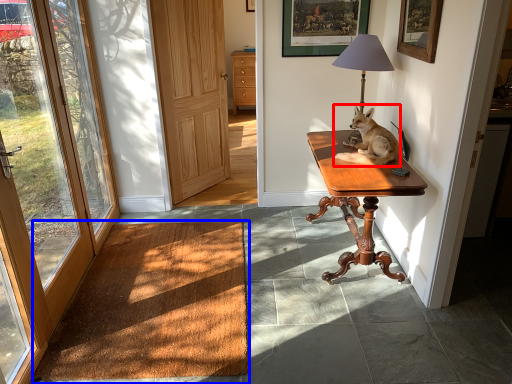
Question: Which of the following is the farthest to the observer, dog (highlighted by a red box) or carpeting board (highlighted by a blue box)?

Choices:
 (A) dog
 (B) carpeting board

Answer: (A)